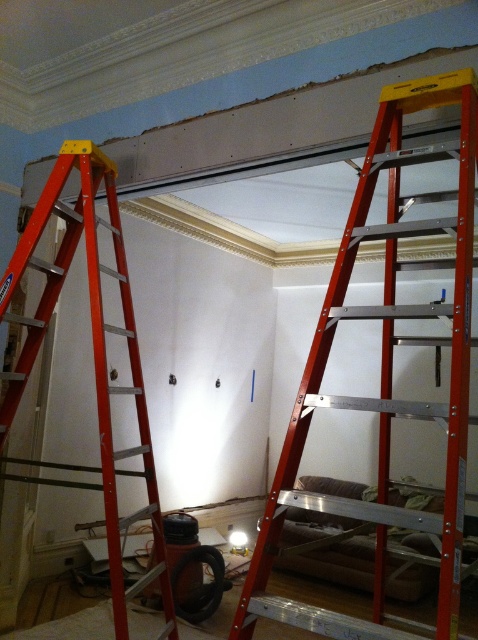
Between metallic red ladder at center and metallic orange ladder at left, which one has less height?

Standing shorter between the two is metallic red ladder at center.

Does point (381, 444) come behind point (99, 156)?

No.

I want to click on metallic red ladder at center, so click(x=386, y=372).